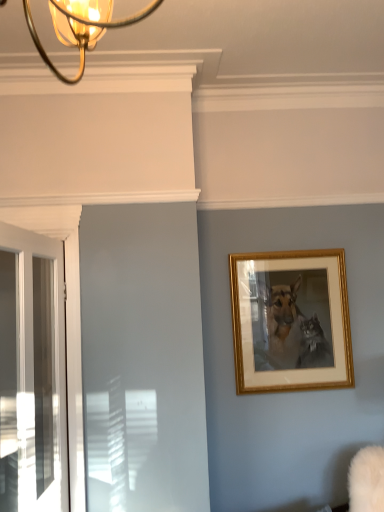
Question: From their relative heights in the image, would you say gold/golden frame at upper right is taller or shorter than white glossy door at left?

Choices:
 (A) short
 (B) tall

Answer: (A)

Question: In terms of size, does gold/golden frame at upper right appear bigger or smaller than white glossy door at left?

Choices:
 (A) big
 (B) small

Answer: (B)

Question: From a real-world perspective, is gold/golden frame at upper right positioned above or below white glossy door at left?

Choices:
 (A) below
 (B) above

Answer: (B)

Question: Considering the relative positions of white glossy door at left and gold/golden frame at upper right in the image provided, is white glossy door at left to the left or to the right of gold/golden frame at upper right?

Choices:
 (A) left
 (B) right

Answer: (A)

Question: Is white glossy door at left inside or outside of gold/golden frame at upper right?

Choices:
 (A) inside
 (B) outside

Answer: (B)

Question: Considering the positions of white glossy door at left and gold/golden frame at upper right in the image, is white glossy door at left taller or shorter than gold/golden frame at upper right?

Choices:
 (A) tall
 (B) short

Answer: (A)

Question: Is point (34, 451) closer or farther from the camera than point (258, 379)?

Choices:
 (A) farther
 (B) closer

Answer: (B)